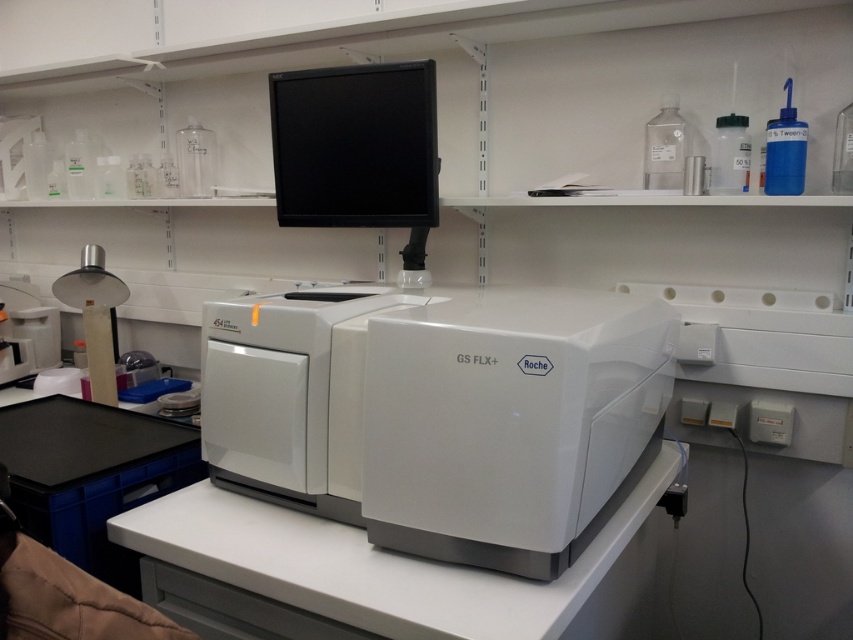
Does white plastic printer at center have a larger size compared to black glossy monitor at upper center?

Yes.

Who is positioned more to the left, white plastic printer at center or black glossy monitor at upper center?

Positioned to the left is black glossy monitor at upper center.

At what (x,y) coordinates should I click in order to perform the action: click on white plastic printer at center. Please return your answer as a coordinate pair (x, y). The width and height of the screenshot is (853, 640). Looking at the image, I should click on (440, 413).

I want to click on white plastic printer at center, so click(440, 413).